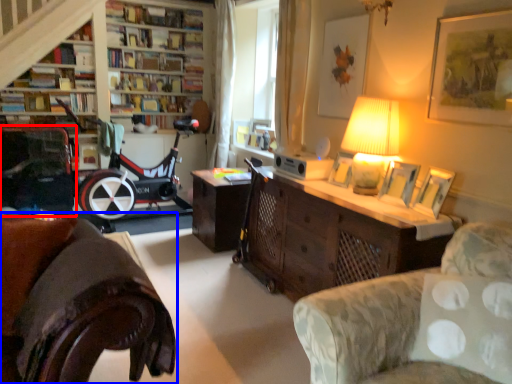
Question: Which point is closer to the camera, armchair (highlighted by a red box) or studio couch (highlighted by a blue box)?

Choices:
 (A) armchair
 (B) studio couch

Answer: (B)